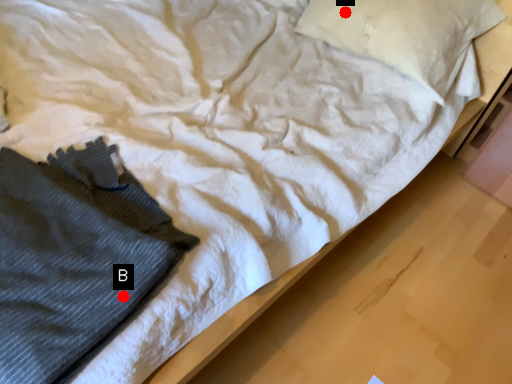
Question: Two points are circled on the image, labeled by A and B beside each circle. Which point is farther to the camera?

Choices:
 (A) A is further
 (B) B is further

Answer: (A)